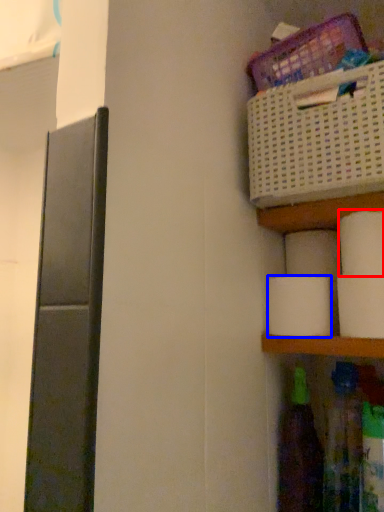
Question: Which of the following is the farthest to the observer, toilet paper (highlighted by a red box) or toilet paper (highlighted by a blue box)?

Choices:
 (A) toilet paper
 (B) toilet paper

Answer: (B)